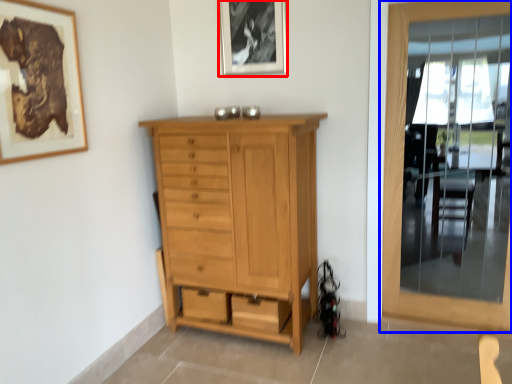
Question: Among these objects, which one is nearest to the camera, picture frame (highlighted by a red box) or door (highlighted by a blue box)?

Choices:
 (A) picture frame
 (B) door

Answer: (B)